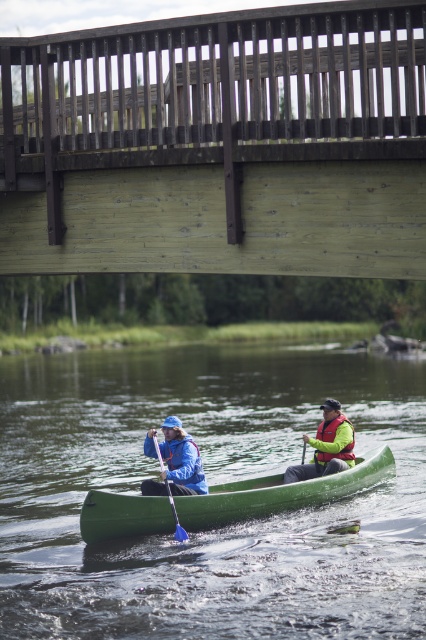
You are a safety inspector checking the canoe. You notice the green life jacket at center and the translucent blue paddle at center. Which item is shorter in height?

The green life jacket at center is shorter than the translucent blue paddle at center because the description states it is not as tall.

You are a safety inspector checking the equipment on the canoe. You notice the green life jacket at center and the translucent blue paddle at center. Which item is bigger in size?

The green life jacket at center has a larger size compared to the translucent blue paddle at center, so the green life jacket at center is bigger.